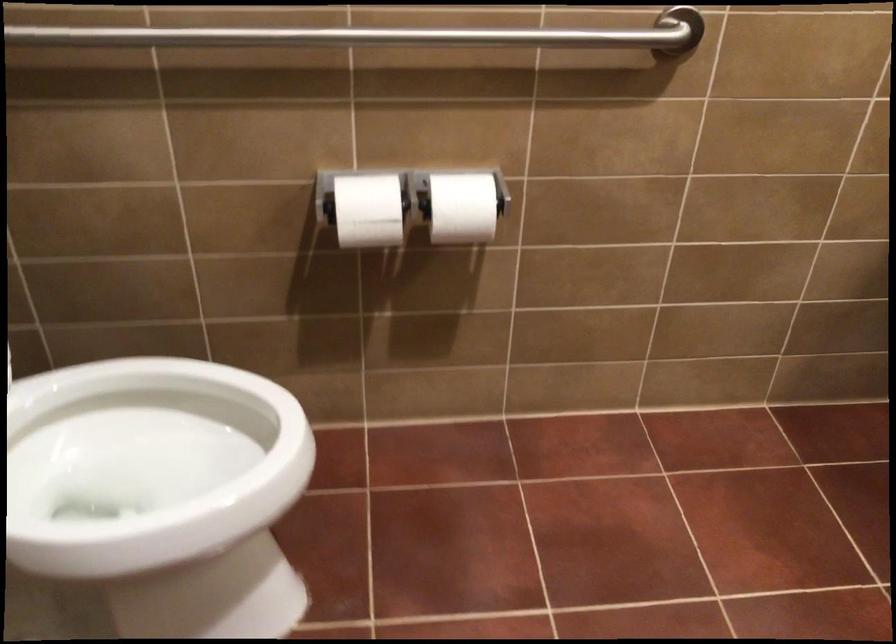
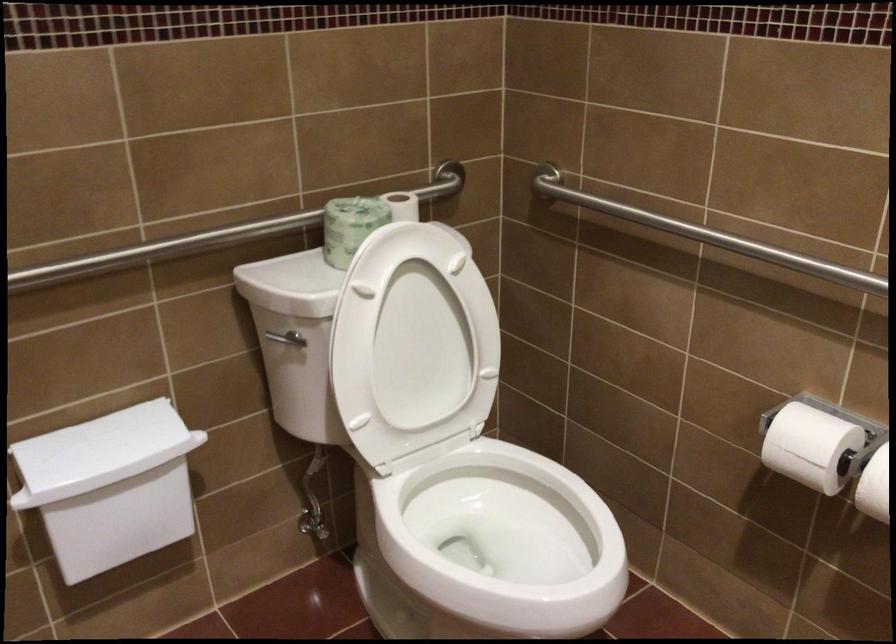
The point at (442, 220) is marked in the first image. Where is the corresponding point in the second image?

(874, 486)